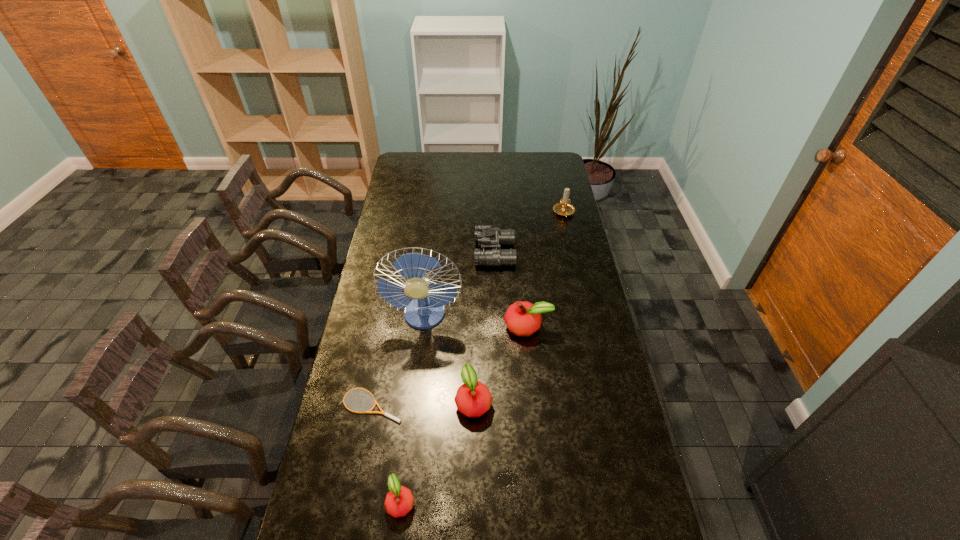
Where is `the nearest apple`? This screenshot has width=960, height=540. the nearest apple is located at coordinates (399, 500).

Identify the location of the sixth tallest object. Image resolution: width=960 pixels, height=540 pixels. (399, 500).

This screenshot has width=960, height=540. Identify the location of the second shortest apple. [473, 399].

Where is `the second nearest apple`? the second nearest apple is located at coordinates (473, 399).

Identify the location of the farthest apple. (522, 318).

Locate an element on the screen. Image resolution: width=960 pixels, height=540 pixels. binoculars is located at coordinates (485, 236).

Image resolution: width=960 pixels, height=540 pixels. Identify the location of candle. (564, 208).

Where is `the rightmost object`? The image size is (960, 540). the rightmost object is located at coordinates (564, 208).

The image size is (960, 540). What are the coordinates of `fan` in the screenshot? It's located at (423, 312).

I want to click on the shortest object, so click(x=384, y=413).